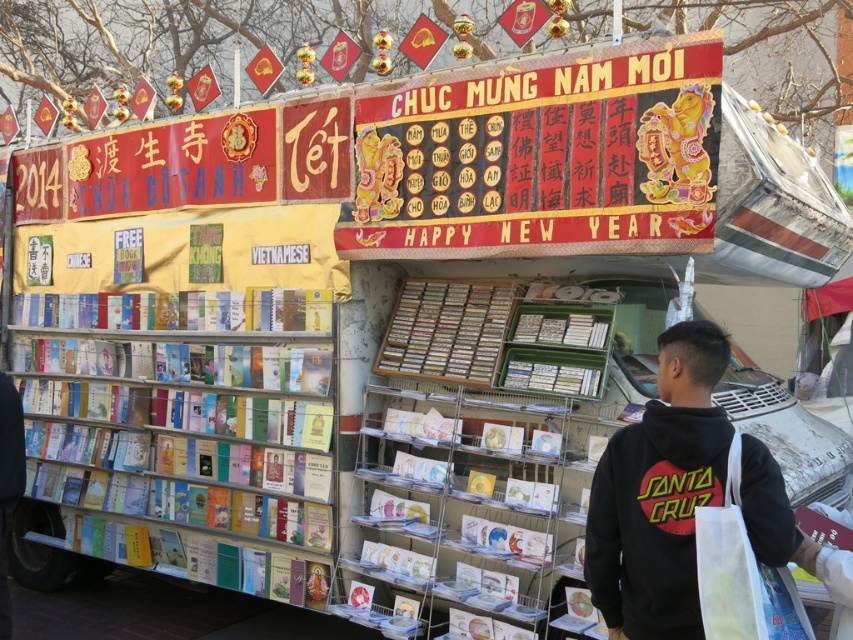
Question: Which point is farther from the camera taking this photo?

Choices:
 (A) (724, 424)
 (B) (292, 593)

Answer: (B)

Question: Is white plastic bookshelf at left positioned behind black cotton hoodie at center?

Choices:
 (A) no
 (B) yes

Answer: (B)

Question: Among these objects, which one is farthest from the camera?

Choices:
 (A) white plastic bookshelf at left
 (B) black cotton hoodie at center

Answer: (A)

Question: Is white plastic bookshelf at left closer to camera compared to black cotton hoodie at center?

Choices:
 (A) yes
 (B) no

Answer: (B)

Question: Does white plastic bookshelf at left appear on the right side of black cotton hoodie at center?

Choices:
 (A) yes
 (B) no

Answer: (B)

Question: Which of the following is the farthest from the observer?

Choices:
 (A) (642, 492)
 (B) (260, 449)

Answer: (B)